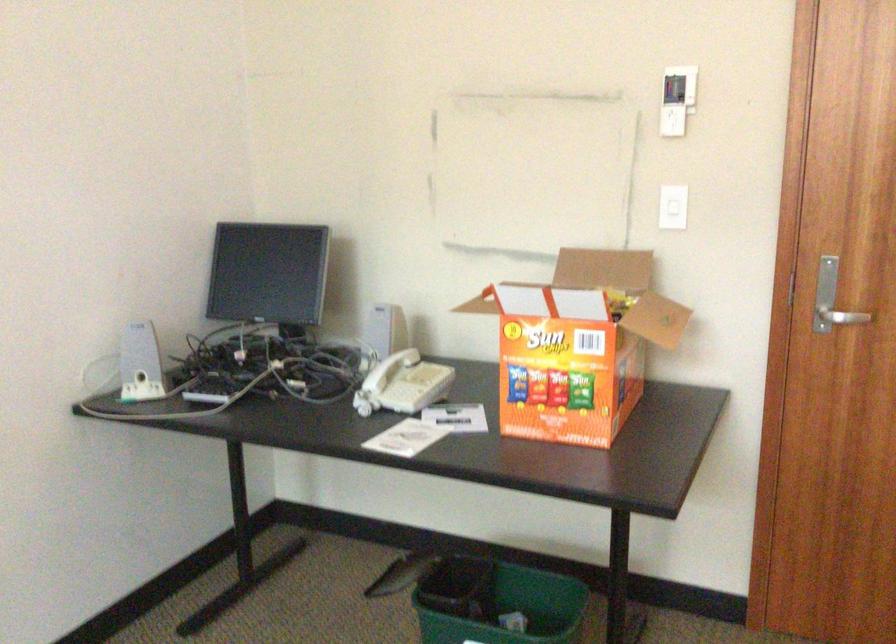
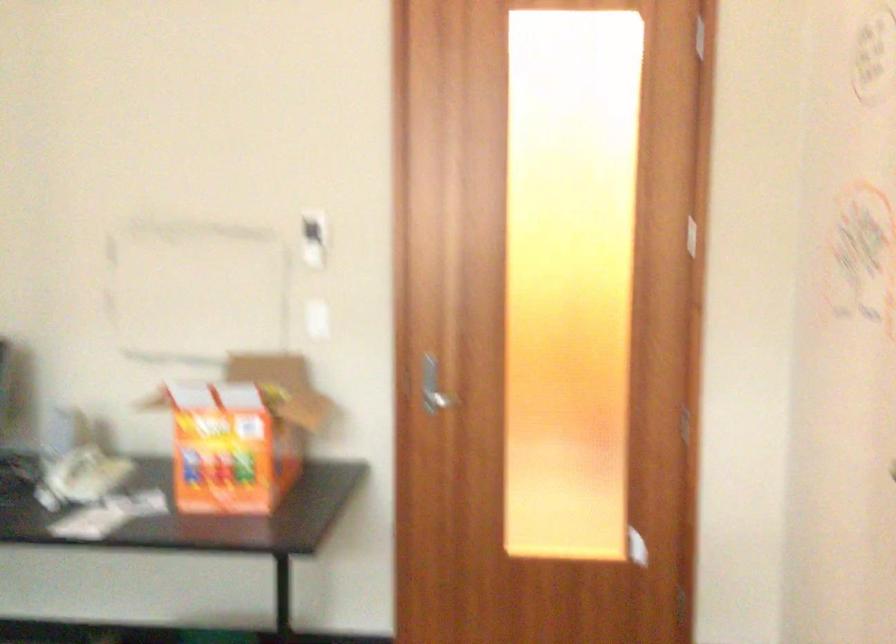
Question: The camera is either moving clockwise (left) or counter-clockwise (right) around the object. The first image is from the beginning of the video and the second image is from the end. Is the camera moving left or right when shooting the video?

Choices:
 (A) Left
 (B) Right

Answer: (A)